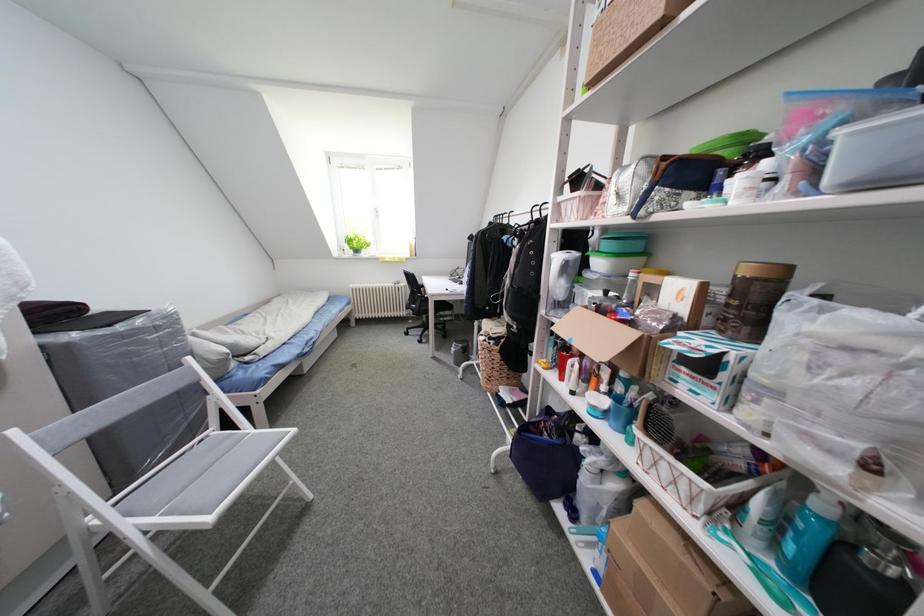
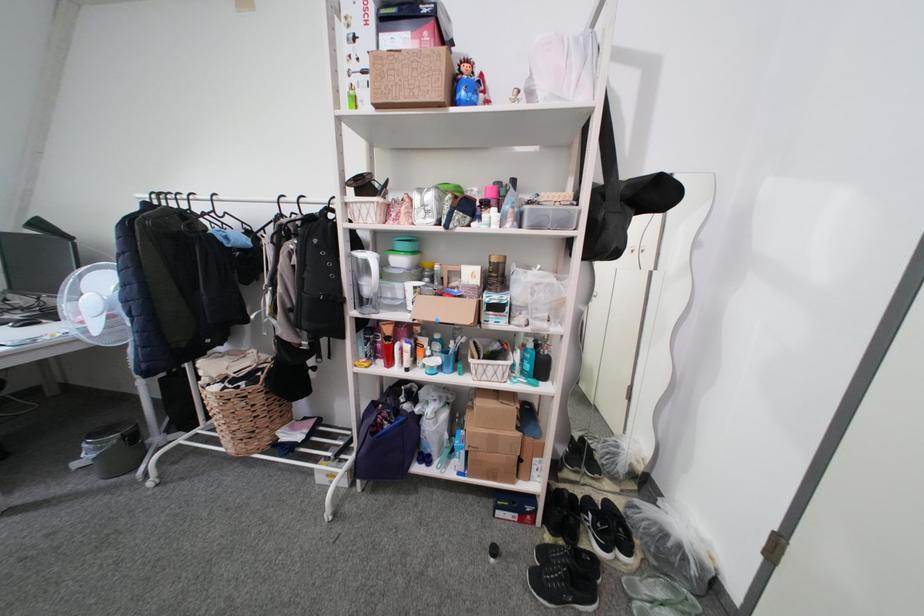
Question: Based on the continuous images, in which direction is the camera rotating? Reply with the corresponding letter.

Choices:
 (A) Left
 (B) Right
 (C) Up
 (D) Down

Answer: (B)